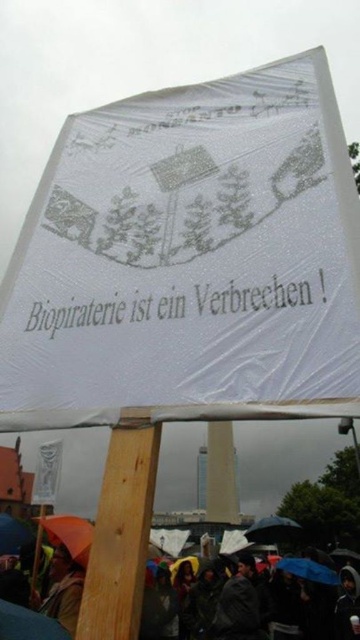
Is point (74, 593) positioned behind point (271, 536)?

That is False.

Locate an element on the screen. The width and height of the screenshot is (360, 640). raincoat at lower left is located at coordinates (64, 589).

The width and height of the screenshot is (360, 640). Find the location of `raincoats at lower center`. raincoats at lower center is located at coordinates (33, 624).

Which of these two, raincoat at lower left or blue fabric umbrella at lower center, stands taller?

With more height is blue fabric umbrella at lower center.

Does raincoat at lower left have a lesser width compared to blue fabric umbrella at lower center?

Yes.

Is point (69, 628) positioned behind point (312, 568)?

No, it is in front of (312, 568).

Identify the location of raincoat at lower left. (64, 589).